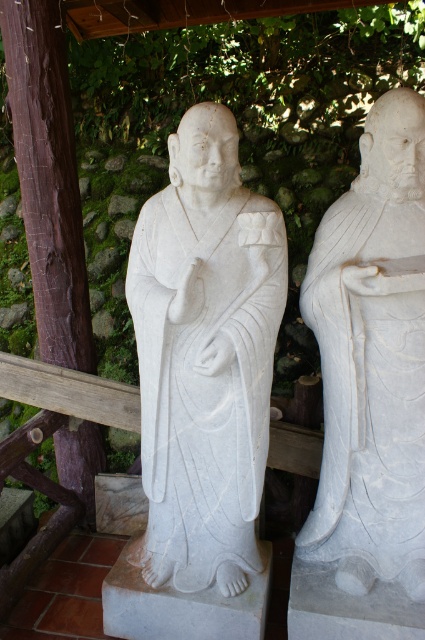
You are a tour guide explaining the layout of the statues to visitors. You want to mention their positions relative to each other. How would you describe the position of the white marble statue at center compared to the white marble statue at right?

The white marble statue at center is positioned to the left of the white marble statue at right.

You are standing in front of the white marble statue at center. If you want to take a photo that includes both the statue and a nearby flower vase placed 5 feet away from you, will the statue be in the frame?

The white marble statue at center is 6.21 feet away from camera, which is farther than the flower vase placed at 5 feet. Since the statue is behind the vase, it might be partially obscured or not fully in the frame depending on the camera angle and lens. However, the exact visibility cannot be determined without additional information about the camera setup.